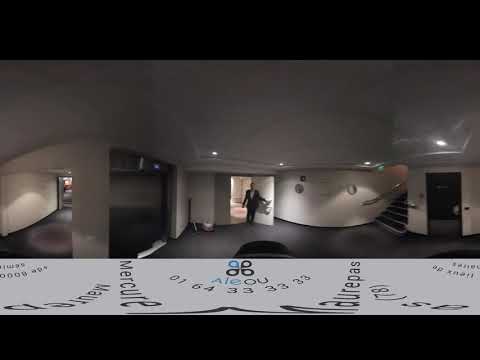
Find the location of a particular element. door is located at coordinates (443, 211), (263, 188), (60, 184).